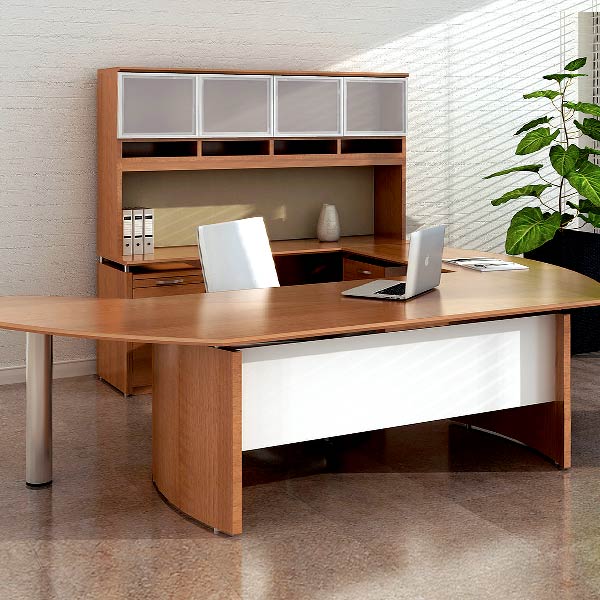
The width and height of the screenshot is (600, 600). In order to click on cubbies in this screenshot , I will do `click(144, 157)`, `click(235, 152)`, `click(299, 149)`, `click(389, 149)`.